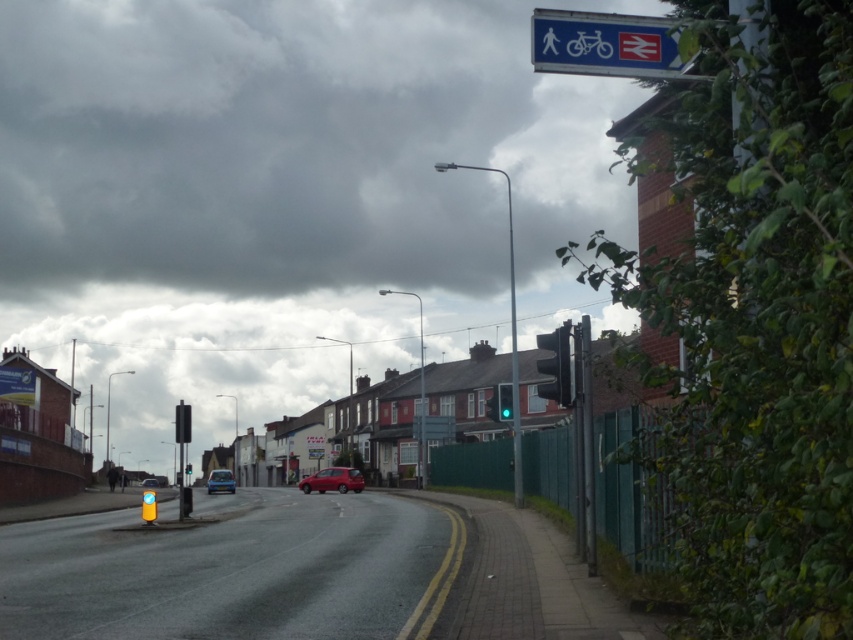
Where is `black plastic traffic light at left`? black plastic traffic light at left is located at coordinates (183, 422).

Which is in front, point (183, 436) or point (142, 481)?

Positioned in front is point (183, 436).

Is point (175, 436) less distant than point (149, 484)?

Yes, it is in front of point (149, 484).

The image size is (853, 640). I want to click on black plastic traffic light at left, so click(183, 422).

Can you confirm if blue plastic sign at upper right is bigger than black plastic traffic light at left?

Incorrect, blue plastic sign at upper right is not larger than black plastic traffic light at left.

Does blue plastic sign at upper right have a smaller size compared to black plastic traffic light at left?

Yes.

Which is in front, point (606, 58) or point (187, 428)?

Point (606, 58) is more forward.

In order to click on blue plastic sign at upper right in this screenshot , I will do `click(605, 44)`.

Does black plastic traffic light at left have a lesser height compared to green glass traffic light at center-right?

In fact, black plastic traffic light at left may be taller than green glass traffic light at center-right.

Find the location of `black plastic traffic light at left`. black plastic traffic light at left is located at coordinates (183, 422).